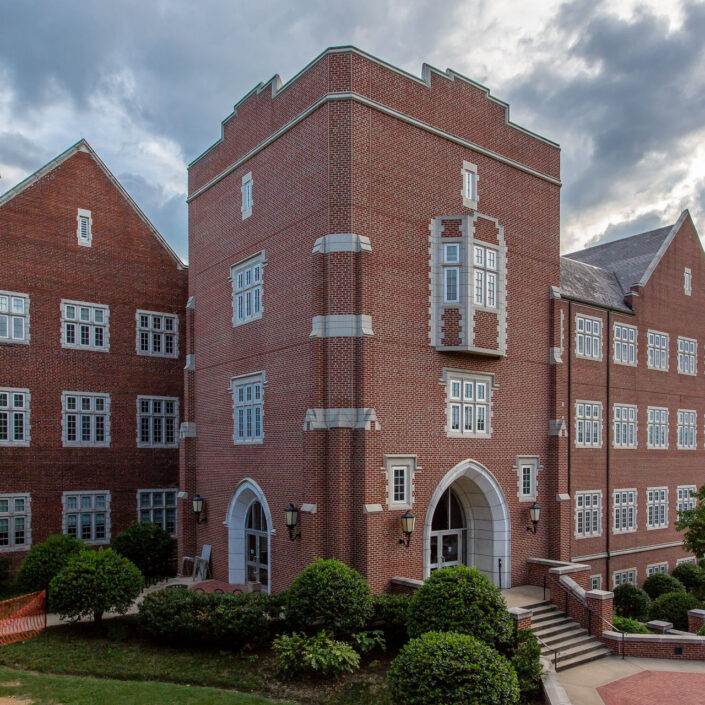
I want to click on trashcan, so click(x=180, y=588).